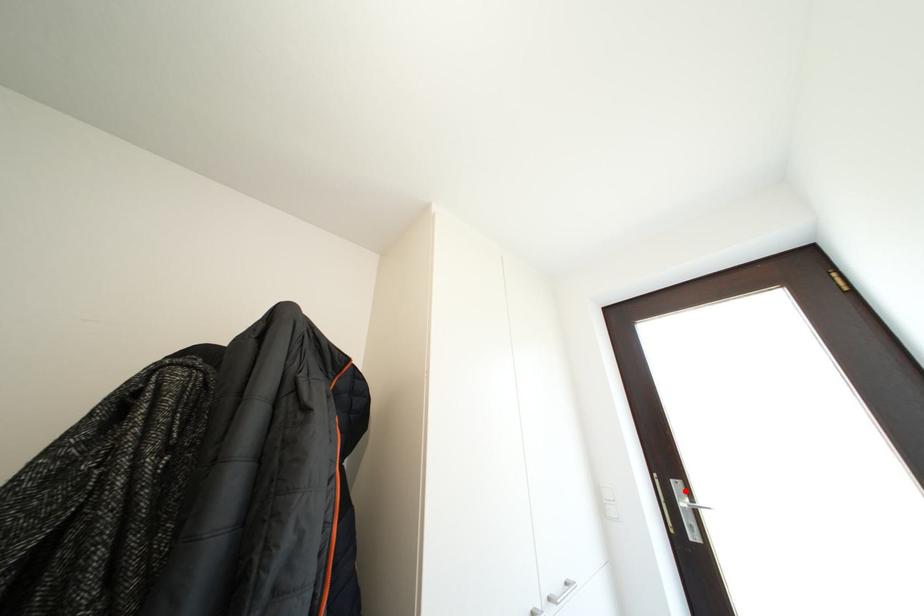
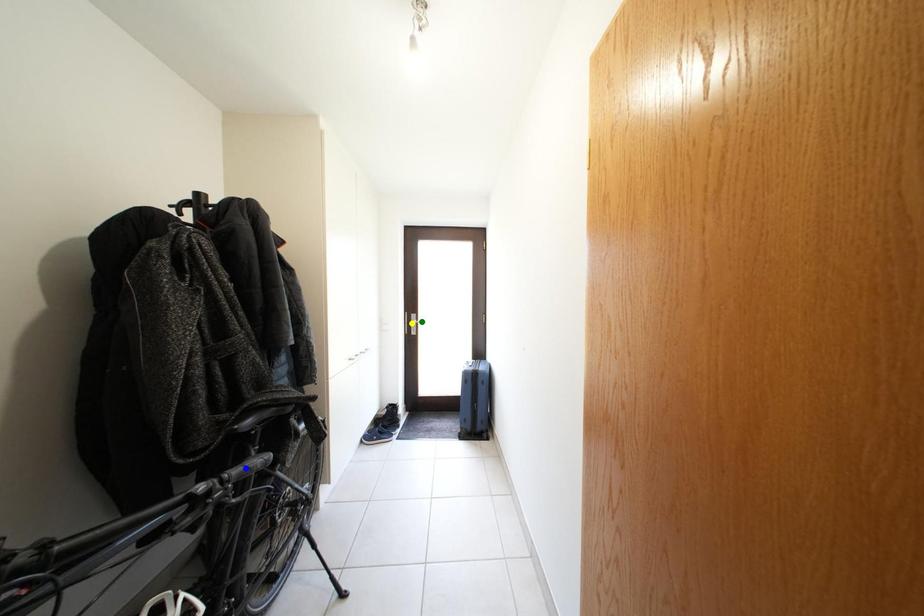
Question: I am providing you with two images of the same scene from different viewpoints. A red point is marked on the first image. You are given multiple points on the second image. Which spot in image 2 lines up with the point in image 1?

Choices:
 (A) yellow point
 (B) blue point
 (C) green point

Answer: (C)